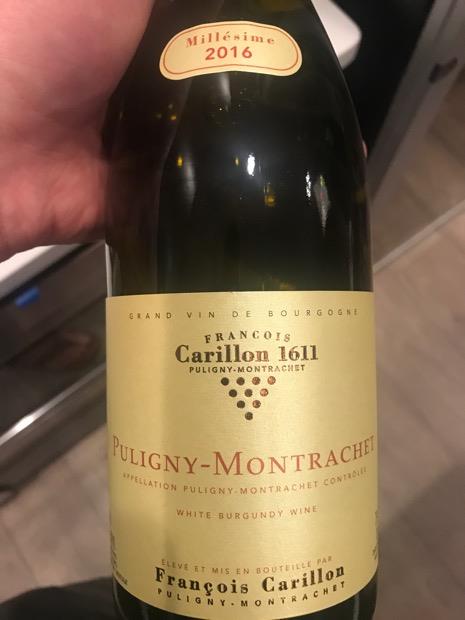
Locate an element on the screen. This screenshot has height=620, width=465. bottle of wine is located at coordinates (133, 147).